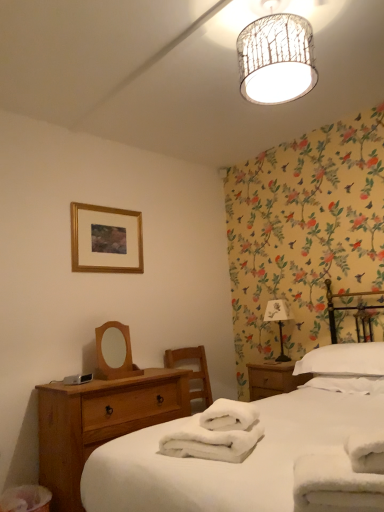
Question: Is white fabric-covered table lamp at right inside or outside of white cotton bed at left?

Choices:
 (A) inside
 (B) outside

Answer: (B)

Question: In the image, is white fabric-covered table lamp at right on the left side or the right side of white cotton bed at left?

Choices:
 (A) left
 (B) right

Answer: (B)

Question: Which of these objects is positioned farthest from the white cotton bed at left?

Choices:
 (A) wooden mirror at left
 (B) white fluffy bath towel at center, marked as the second bath towel in a back-to-front arrangement
 (C) light brown wood at lower left
 (D) white soft pillow at right
 (E) white fabric-covered table lamp at right

Answer: (E)

Question: Which of these objects is positioned farthest from the white fabric-covered table lamp at right?

Choices:
 (A) white cotton bed at left
 (B) white soft pillow at right
 (C) gold-framed picture at upper left
 (D) white fluffy bath towel at lower right, acting as the 2th bath towel starting from the left
 (E) light brown wood at lower left

Answer: (D)